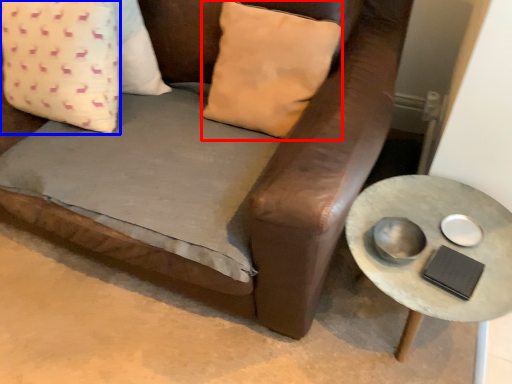
Question: Among these objects, which one is farthest to the camera, pillow (highlighted by a red box) or pillow (highlighted by a blue box)?

Choices:
 (A) pillow
 (B) pillow

Answer: (B)